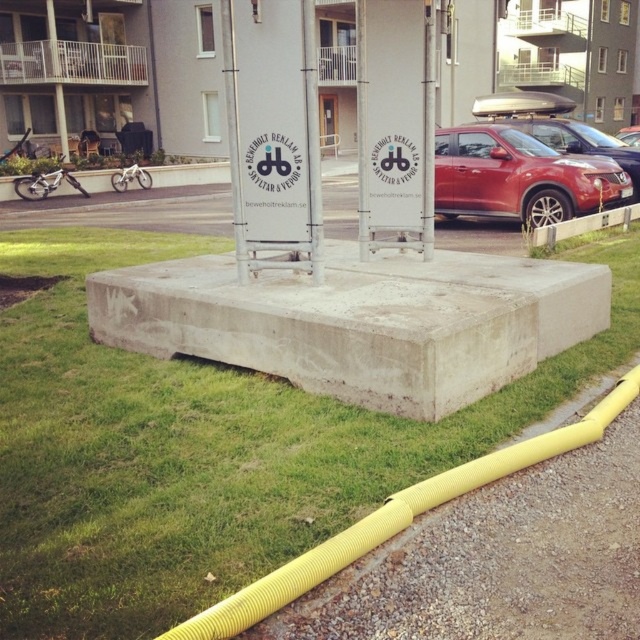
Question: Is gray concrete block at center thinner than concrete curb at lower right?

Choices:
 (A) no
 (B) yes

Answer: (A)

Question: Is gray concrete block at center in front of concrete curb at lower right?

Choices:
 (A) no
 (B) yes

Answer: (B)

Question: Which object is the farthest from the matte red car at right?

Choices:
 (A) concrete curb at lower right
 (B) gray concrete block at center

Answer: (B)

Question: Which point appears closest to the camera in this image?

Choices:
 (A) (435, 257)
 (B) (493, 214)
 (C) (636, 204)

Answer: (A)

Question: Estimate the real-world distances between objects in this image. Which object is closer to the gray concrete block at center?

Choices:
 (A) concrete curb at lower right
 (B) matte red car at right
 (C) green grass at lower left

Answer: (C)

Question: Can you confirm if gray concrete block at center is thinner than concrete curb at lower right?

Choices:
 (A) no
 (B) yes

Answer: (A)